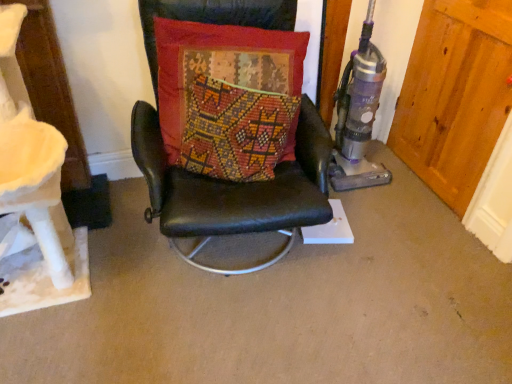
Where is `vacant space to the right of black leather chair at center`? The width and height of the screenshot is (512, 384). vacant space to the right of black leather chair at center is located at coordinates (391, 265).